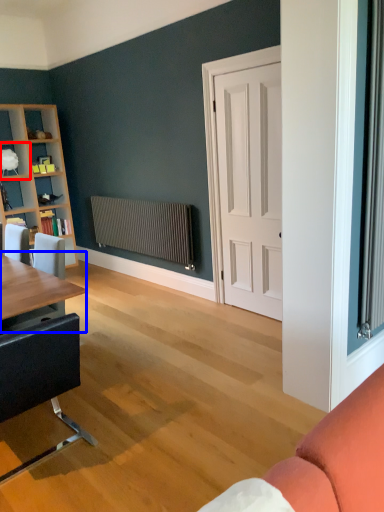
Question: Which of the following is the closest to the observer, shelf (highlighted by a red box) or table (highlighted by a blue box)?

Choices:
 (A) shelf
 (B) table

Answer: (B)